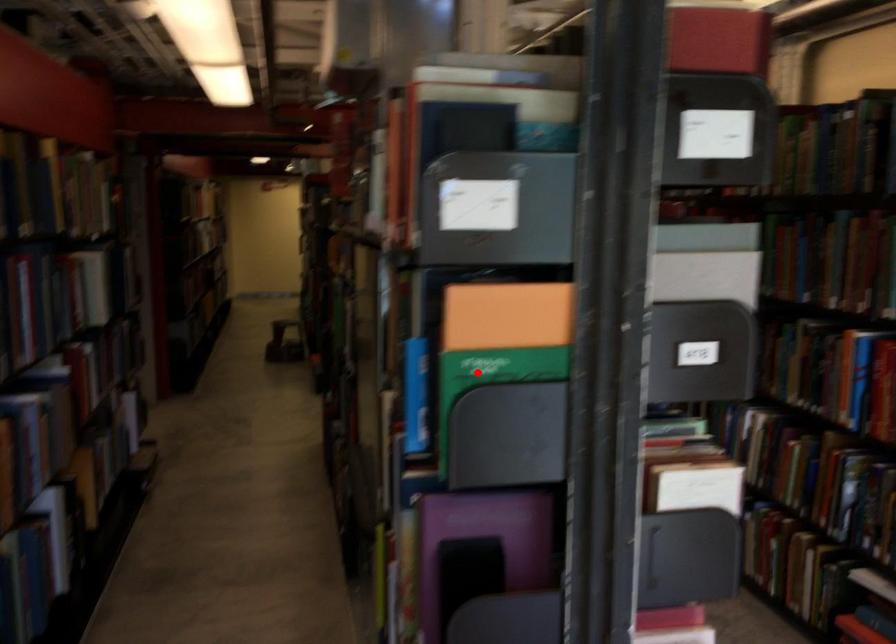
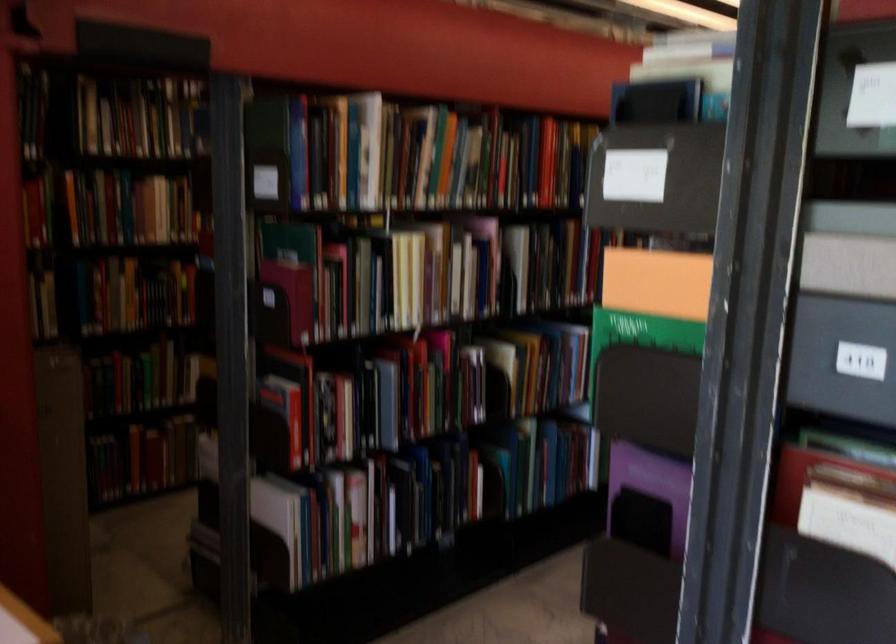
Locate, in the second image, the point that corresponds to the highlighted location in the first image.

(635, 327)